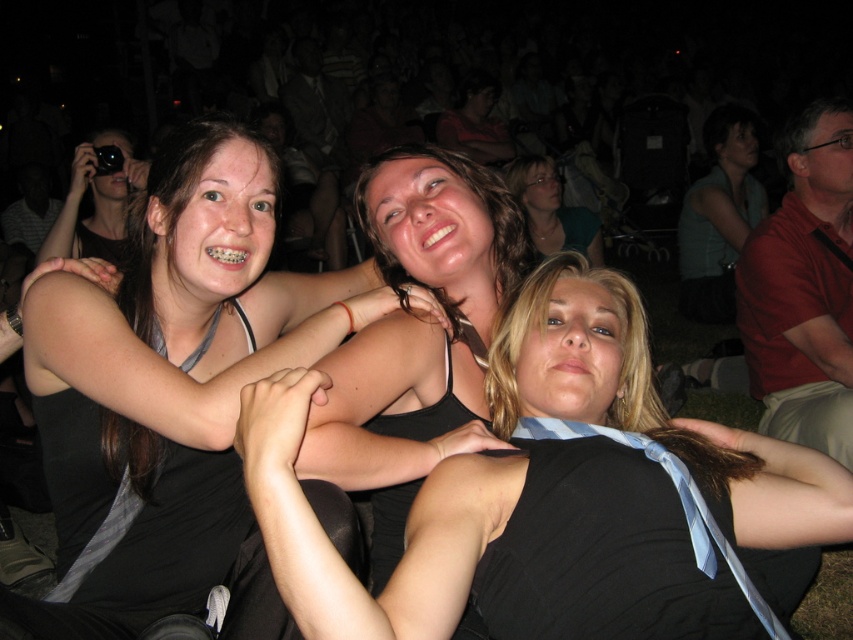
Can you confirm if black fabric at center is wider than black matte dress at left?

Indeed, black fabric at center has a greater width compared to black matte dress at left.

Does black fabric at center come behind black matte dress at left?

No, it is in front of black matte dress at left.

Does point (677, 525) lie behind point (202, 516)?

No, (677, 525) is closer to viewer.

This screenshot has height=640, width=853. I want to click on black fabric at center, so click(556, 496).

Does black silk dress at center lie in front of black matte dress at left?

Yes, black silk dress at center is in front of black matte dress at left.

What do you see at coordinates (627, 548) in the screenshot? The image size is (853, 640). I see `black silk dress at center` at bounding box center [627, 548].

The height and width of the screenshot is (640, 853). I want to click on black silk dress at center, so click(x=627, y=548).

Does black matte tank top at upper center have a lesser height compared to black matte dress at left?

Incorrect, black matte tank top at upper center's height does not fall short of black matte dress at left's.

Which is below, black matte tank top at upper center or black matte dress at left?

black matte dress at left is below.

Find the location of `black matte tank top at upper center`. black matte tank top at upper center is located at coordinates (167, 385).